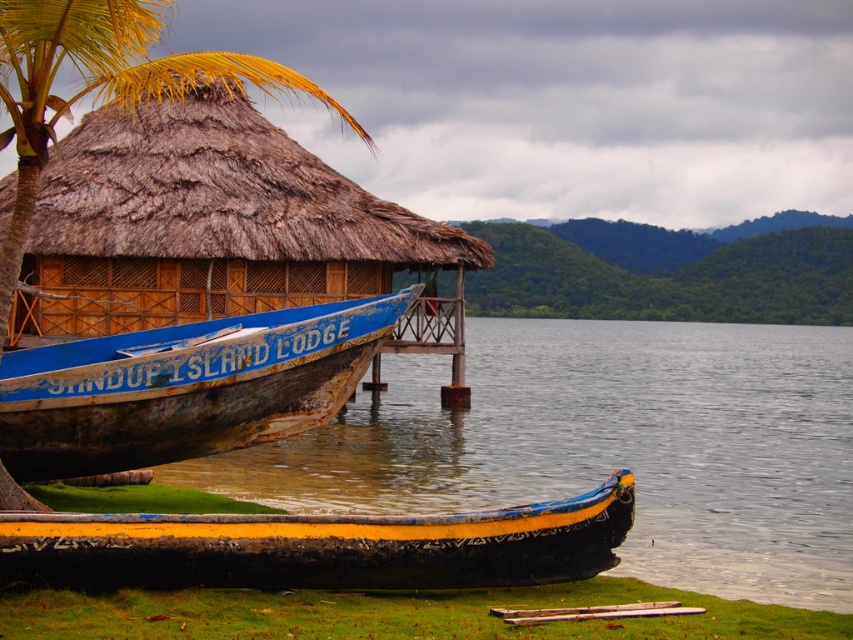
Question: Among these objects, which one is farthest from the camera?

Choices:
 (A) wooden at lower center
 (B) yellow painted wood canoe at lower center
 (C) brown thatch palm tree at upper left

Answer: (C)

Question: Does yellow painted wood canoe at lower center appear over brown thatch palm tree at upper left?

Choices:
 (A) yes
 (B) no

Answer: (B)

Question: Can you confirm if rusty wood boat at lower left is thinner than wooden at lower center?

Choices:
 (A) no
 (B) yes

Answer: (B)

Question: Which object is farther from the camera taking this photo?

Choices:
 (A) yellow painted wood canoe at lower center
 (B) rusty wood boat at lower left
 (C) brown thatch palm tree at upper left
 (D) wooden at lower center

Answer: (B)

Question: Estimate the real-world distances between objects in this image. Which object is closer to the wooden at lower center?

Choices:
 (A) brown thatch palm tree at upper left
 (B) rusty wood boat at lower left

Answer: (B)

Question: Is yellow painted wood canoe at lower center above brown thatch palm tree at upper left?

Choices:
 (A) no
 (B) yes

Answer: (A)